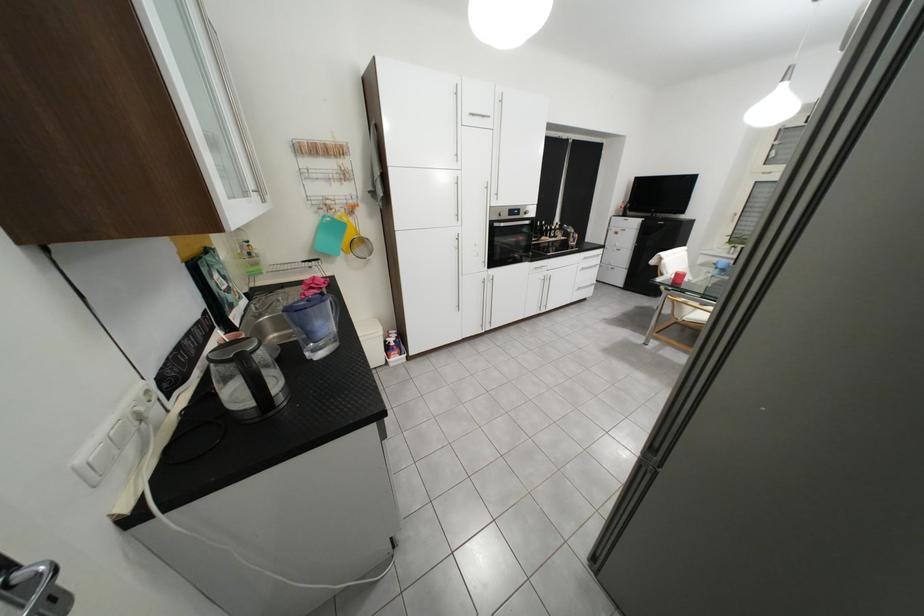
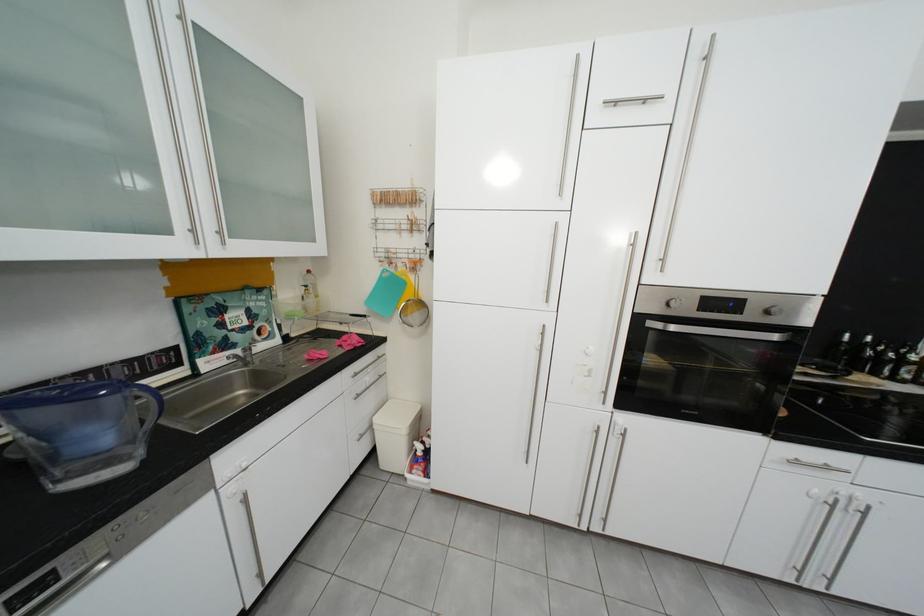
Locate, in the second image, the point that corresponds to (x=345, y=199) in the first image.

(406, 252)